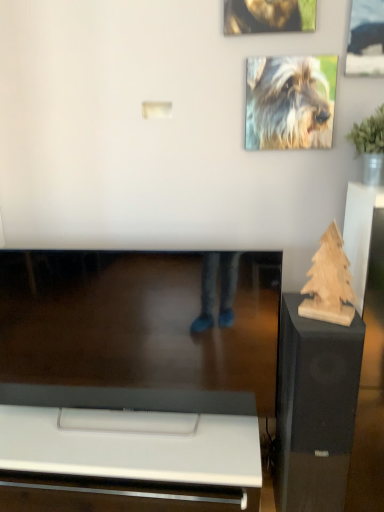
Question: Relative to fluffy fur dog at upper right, which is counted as the first dog, starting from the bottom, is wooden sculpture at right in front or behind?

Choices:
 (A) front
 (B) behind

Answer: (A)

Question: Visually, is wooden sculpture at right positioned to the left or to the right of fluffy fur dog at upper right, which is counted as the first dog, starting from the bottom?

Choices:
 (A) right
 (B) left

Answer: (A)

Question: Which object is positioned farthest from the fluffy fur dog at upper right, marked as the second dog in a top-to-bottom arrangement?

Choices:
 (A) wooden sculpture at right
 (B) shiny golden fur at upper center, which ranks as the second dog in bottom-to-top order
 (C) metallic silver picture frame at upper right

Answer: (A)

Question: Which object is the closest to the fluffy fur dog at upper right, marked as the second dog in a top-to-bottom arrangement?

Choices:
 (A) wooden sculpture at right
 (B) metallic silver picture frame at upper right
 (C) shiny golden fur at upper center, marked as the 1th dog in a top-to-bottom arrangement

Answer: (B)